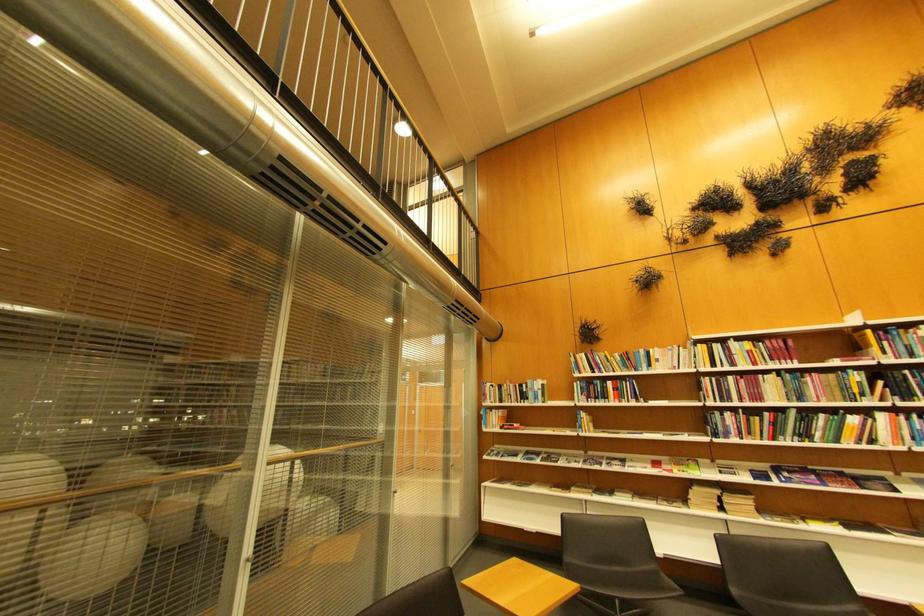
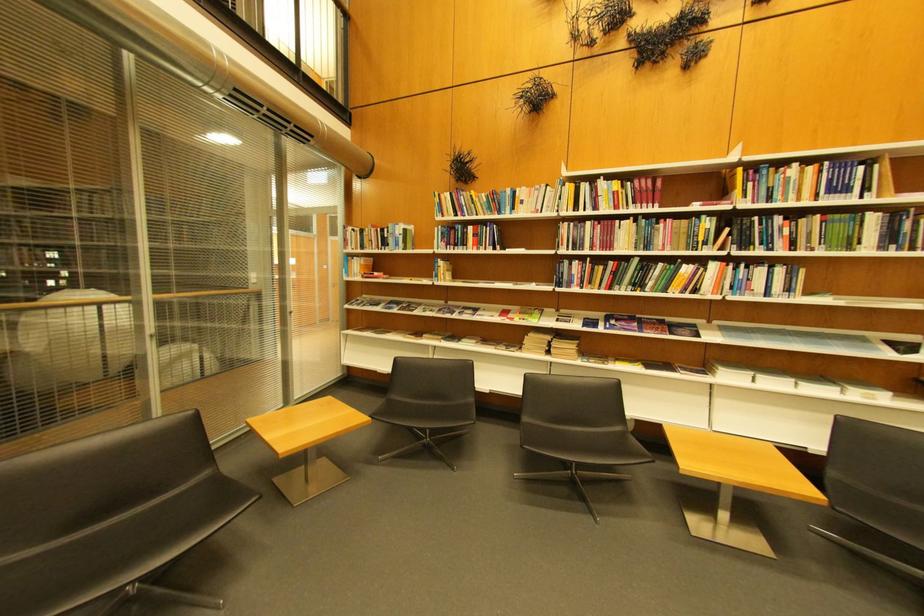
Locate, in the second image, the point that corresponds to [777,344] in the first image.

(648, 183)